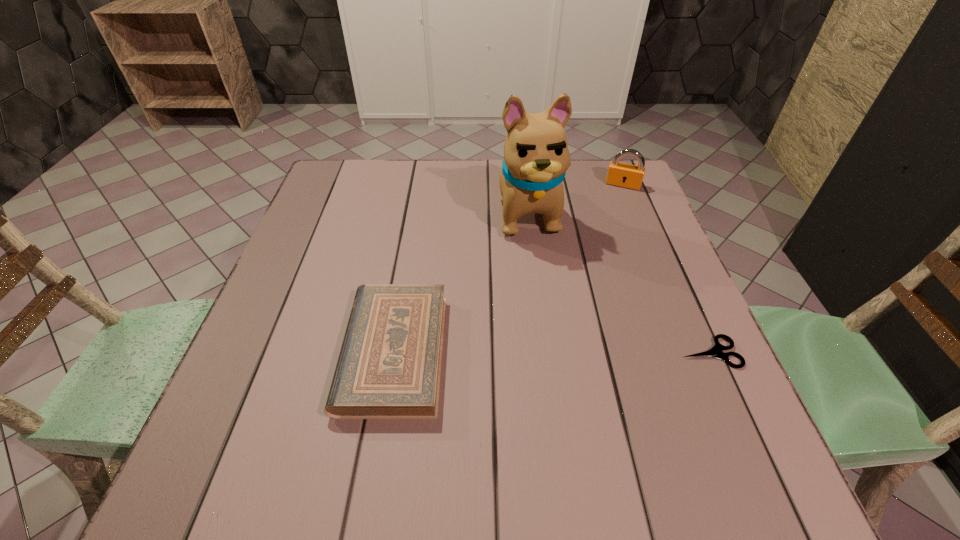
Locate an element on the screen. vacant space on the desktop that is between the third tallest object and the shears and is positioned on the face of the third object from right to left is located at coordinates (569, 352).

In order to click on vacant space on the desktop that is between the leftmost object and the shortest object and is positioned to unlock the padlock from the front in this screenshot , I will do `click(572, 352)`.